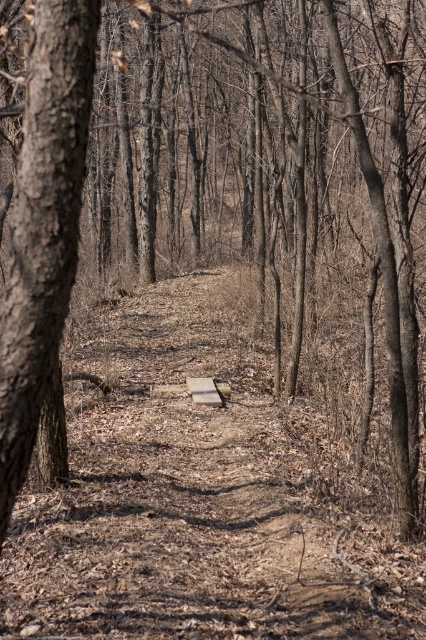
Is rough bark tree at left closer to the viewer compared to wooden bench at center?

Yes, rough bark tree at left is in front of wooden bench at center.

Who is higher up, rough bark tree at left or wooden bench at center?

Positioned higher is rough bark tree at left.

I want to click on rough bark tree at left, so click(x=43, y=225).